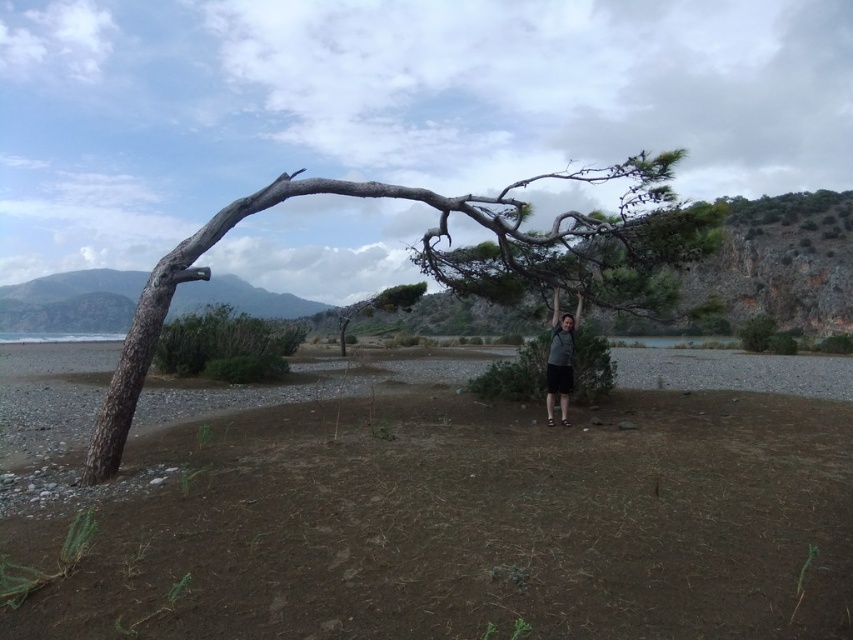
Between brown dirt at center and gray bark tree at center, which one appears on the right side from the viewer's perspective?

Positioned to the right is brown dirt at center.

Is point (401, 620) farther from camera compared to point (373, 195)?

No.

Who is more distant from viewer, (486, 470) or (663, 236)?

Positioned behind is point (663, 236).

Locate an element on the screen. brown dirt at center is located at coordinates tap(491, 515).

Which is more to the right, brown dirt at center or dark gray fabric shirt at center?

Positioned to the right is brown dirt at center.

Is brown dirt at center shorter than dark gray fabric shirt at center?

Yes, brown dirt at center is shorter than dark gray fabric shirt at center.

The image size is (853, 640). What are the coordinates of `brown dirt at center` in the screenshot? It's located at (491, 515).

Describe the element at coordinates (437, 260) in the screenshot. I see `gray bark tree at center` at that location.

Which of these two, gray bark tree at center or dark gray fabric shirt at center, stands shorter?

With less height is dark gray fabric shirt at center.

Which is behind, point (428, 273) or point (566, 390)?

Point (428, 273)

Find the location of a particular element. The width and height of the screenshot is (853, 640). gray bark tree at center is located at coordinates (437, 260).